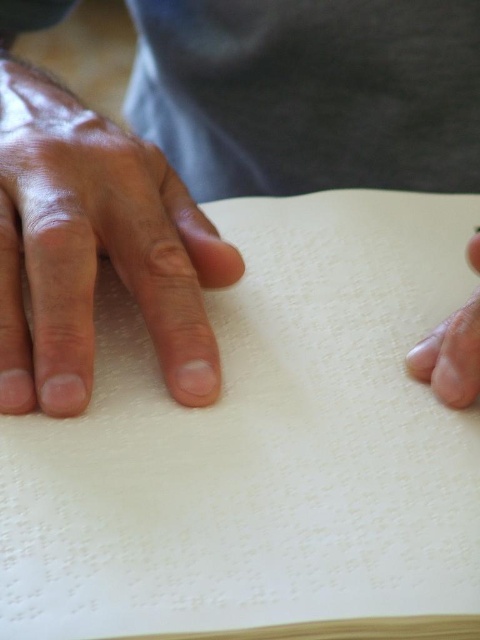
Question: Can you confirm if white paper at center is wider than smooth skin at lower right?

Choices:
 (A) no
 (B) yes

Answer: (B)

Question: Which point is closer to the camera?

Choices:
 (A) (52, 109)
 (B) (325, 422)
 (C) (86, 248)
 (D) (467, 401)

Answer: (B)

Question: Considering the relative positions of smooth paper at center and dry skin at left in the image provided, where is smooth paper at center located with respect to dry skin at left?

Choices:
 (A) above
 (B) below

Answer: (A)

Question: Does white paper at center come behind dry skin at left?

Choices:
 (A) no
 (B) yes

Answer: (A)

Question: Among these points, which one is farthest from the camera?

Choices:
 (A) (264, 147)
 (B) (58, 321)
 (C) (260, 614)
 (D) (445, 404)

Answer: (A)

Question: Estimate the real-world distances between objects in this image. Which object is closer to the dry skin at left?

Choices:
 (A) smooth paper at center
 (B) white paper at center

Answer: (B)